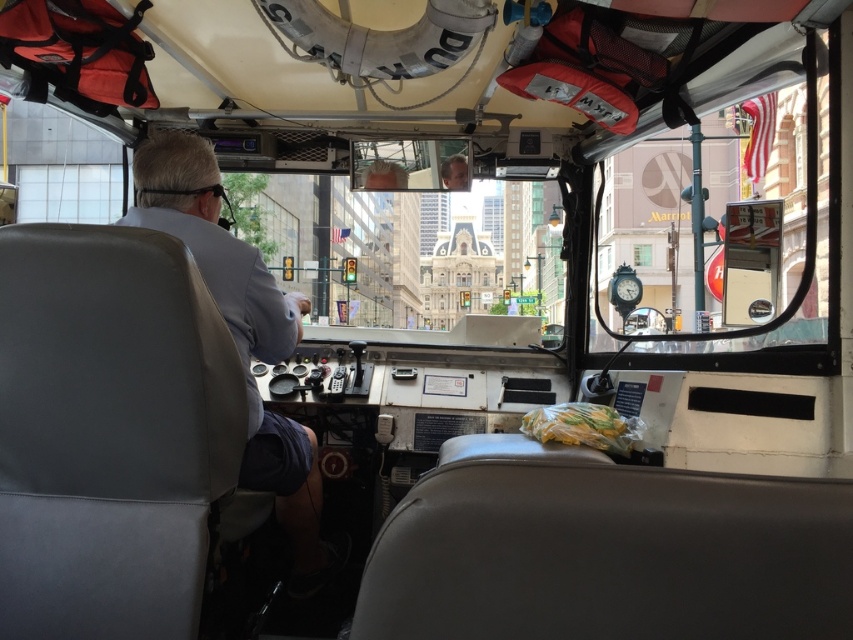
Is point (157, 195) positioned after point (635, 257)?

No, it is in front of (635, 257).

Does point (244, 336) lie in front of point (636, 262)?

Yes, point (244, 336) is in front of point (636, 262).

Does point (200, 138) come in front of point (651, 260)?

That is True.

What are the coordinates of `white leather jacket at left` in the screenshot? It's located at (241, 336).